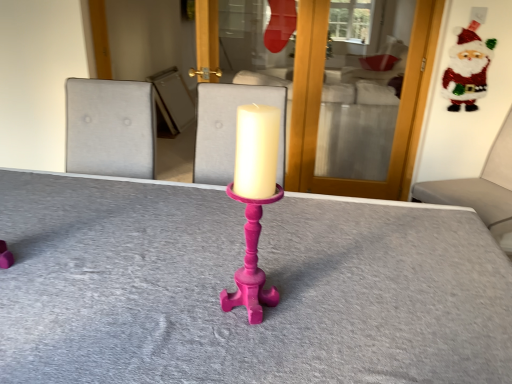
The image size is (512, 384). What do you see at coordinates (234, 288) in the screenshot?
I see `matte pink candlestick at center` at bounding box center [234, 288].

Identify the location of velvet grey cushion at right. The height and width of the screenshot is (384, 512). click(x=481, y=189).

Which of these two, shiny glitter santa at upper right or matte pink candlestick at center, stands shorter?

With less height is shiny glitter santa at upper right.

From a real-world perspective, is shiny glitter santa at upper right positioned above or below matte pink candlestick at center?

In terms of real-world spatial position, shiny glitter santa at upper right is above matte pink candlestick at center.

Consider the image. From the image's perspective, is shiny glitter santa at upper right located above or below matte pink candlestick at center?

Based on their image positions, shiny glitter santa at upper right is located above matte pink candlestick at center.

Considering the relative positions of shiny glitter santa at upper right and matte pink candlestick at center in the image provided, is shiny glitter santa at upper right to the left or to the right of matte pink candlestick at center?

shiny glitter santa at upper right is positioned on matte pink candlestick at center's right side.

From a real-world perspective, is velvet grey cushion at right physically located above or below matte pink candle holder at center?

From a real-world perspective, velvet grey cushion at right is physically below matte pink candle holder at center.

From the image's perspective, is velvet grey cushion at right beneath matte pink candle holder at center?

No, from the image's perspective, velvet grey cushion at right is not below matte pink candle holder at center.

How different are the orientations of velvet grey cushion at right and matte pink candle holder at center in degrees?

They differ by 121 degrees in their facing directions.

Is velvet grey cushion at right inside the boundaries of matte pink candle holder at center, or outside?

velvet grey cushion at right is spatially situated outside matte pink candle holder at center.

Does matte pink candle holder at center contain velvet grey cushion at right?

Definitely not — velvet grey cushion at right is not inside matte pink candle holder at center.

From the image's perspective, which one is positioned higher, matte pink candle holder at center or velvet grey cushion at right?

velvet grey cushion at right, from the image's perspective.

Which of these two, matte pink candle holder at center or velvet grey cushion at right, stands taller?

Standing taller between the two is velvet grey cushion at right.

Considering their positions, is matte pink candle holder at center located in front of or behind velvet grey cushion at right?

In the image, matte pink candle holder at center appears in front of velvet grey cushion at right.

Between point (472, 108) and point (488, 168), which one is positioned in front?

Point (472, 108)

Locate an element on the screen. santa claus located above the velvet grey cushion at right (from a real-world perspective) is located at coordinates (467, 68).

Which of these two, shiny glitter santa at upper right or velvet grey cushion at right, is thinner?

shiny glitter santa at upper right is thinner.

From a real-world perspective, between shiny glitter santa at upper right and velvet grey cushion at right, who is vertically higher?

shiny glitter santa at upper right.

Consider the image. From a real-world perspective, does matte pink candlestick at center stand above matte pink candle holder at center?

No, from a real-world perspective, matte pink candlestick at center is not on top of matte pink candle holder at center.

Is matte pink candlestick at center oriented away from matte pink candle holder at center?

No, matte pink candlestick at center is not facing away from matte pink candle holder at center.

Looking at this image, between matte pink candlestick at center and matte pink candle holder at center, which one has larger size?

matte pink candlestick at center is bigger.

How many degrees apart are the facing directions of matte pink candlestick at center and matte pink candle holder at center?

0.471 degrees.

Considering the positions of objects matte pink candle holder at center and matte pink candlestick at center in the image provided, who is behind, matte pink candle holder at center or matte pink candlestick at center?

matte pink candle holder at center is further from the camera.

Would you say matte pink candle holder at center is a long distance from matte pink candlestick at center?

Actually, matte pink candle holder at center and matte pink candlestick at center are a little close together.

Considering the relative sizes of matte pink candle holder at center and matte pink candlestick at center in the image provided, is matte pink candle holder at center bigger than matte pink candlestick at center?

Actually, matte pink candle holder at center might be smaller than matte pink candlestick at center.

In the image, there is a velvet grey cushion at right. In order to click on table below it (from a real-world perspective) in this screenshot , I will do `click(234, 288)`.

From a real-world perspective, which is physically above, matte pink candlestick at center or velvet grey cushion at right?

velvet grey cushion at right, from a real-world perspective.

Based on the photo, considering the relative positions of matte pink candlestick at center and velvet grey cushion at right in the image provided, is matte pink candlestick at center to the left of velvet grey cushion at right from the viewer's perspective?

Correct, you'll find matte pink candlestick at center to the left of velvet grey cushion at right.

Find the location of a particular element. This screenshot has height=384, width=512. table below the shiny glitter santa at upper right (from a real-world perspective) is located at coordinates (234, 288).

You are a GUI agent. You are given a task and a screenshot of the screen. Output one action in this format:
    pyautogui.click(x=<x>, y=<y>)
    Task: Click on the furniture above the matte pink candle holder at center (from the image's perspective)
    The image size is (512, 384).
    Given the screenshot: What is the action you would take?
    pyautogui.click(x=481, y=189)

Which object lies further to the anchor point shiny glitter santa at upper right, velvet grey cushion at right or matte pink candle holder at center?

matte pink candle holder at center is positioned further to the anchor shiny glitter santa at upper right.

Looking at the image, which one is located further to velvet grey cushion at right, matte pink candlestick at center or shiny glitter santa at upper right?

matte pink candlestick at center.

Estimate the real-world distances between objects in this image. Which object is closer to matte pink candlestick at center, velvet grey cushion at right or matte pink candle holder at center?

Among the two, matte pink candle holder at center is located nearer to matte pink candlestick at center.

From the image, which object appears to be farther from matte pink candlestick at center, shiny glitter santa at upper right or velvet grey cushion at right?

The object further to matte pink candlestick at center is shiny glitter santa at upper right.

From the image, which object appears to be nearer to matte pink candlestick at center, matte pink candle holder at center or velvet grey cushion at right?

The object closer to matte pink candlestick at center is matte pink candle holder at center.

From the picture: Looking at the image, which one is located closer to matte pink candle holder at center, velvet grey cushion at right or matte pink candlestick at center?

matte pink candlestick at center is positioned closer to the anchor matte pink candle holder at center.

Estimate the real-world distances between objects in this image. Which object is closer to shiny glitter santa at upper right, matte pink candlestick at center or matte pink candle holder at center?

The object closer to shiny glitter santa at upper right is matte pink candlestick at center.

Based on their spatial positions, is shiny glitter santa at upper right or matte pink candlestick at center closer to matte pink candle holder at center?

matte pink candlestick at center is closer to matte pink candle holder at center.

At what (x,y) coordinates should I click in order to perform the action: click on santa claus between matte pink candlestick at center and velvet grey cushion at right in the horizontal direction. Please return your answer as a coordinate pair (x, y). Image resolution: width=512 pixels, height=384 pixels. Looking at the image, I should click on (467, 68).

The image size is (512, 384). Identify the location of candle holder between matte pink candlestick at center and shiny glitter santa at upper right along the z-axis. (251, 264).

The image size is (512, 384). I want to click on furniture located between matte pink candle holder at center and shiny glitter santa at upper right in the depth direction, so click(x=481, y=189).

Where is `candle holder between matte pink candlestick at center and velvet grey cushion at right in the horizontal direction`? This screenshot has width=512, height=384. candle holder between matte pink candlestick at center and velvet grey cushion at right in the horizontal direction is located at coordinates (251, 264).